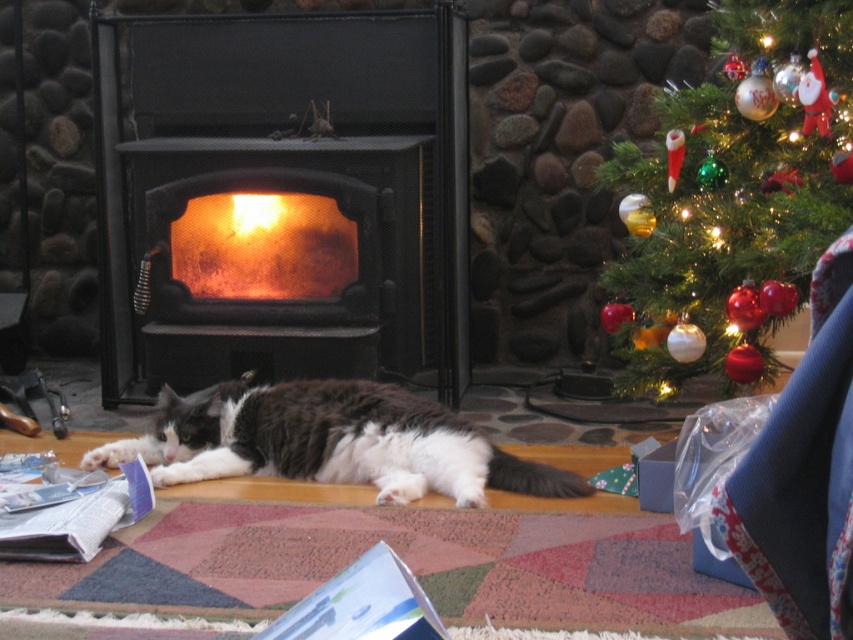
You are standing at the entrance of the room and want to move towards the fireplace. There are two points marked in the scene, point (x=624, y=276) and point (x=328, y=432). Which point should you step on first to reach the fireplace?

You should step on point (x=624, y=276) first because it is in front of point (x=328, y=432), meaning it is closer to your starting position at the entrance.

You are standing in the room and want to take a photo of both the fluffy white and gray cat at center and the orange glassy fire at center. Which object should you position to the left side of your camera frame to include both in the shot?

Since the fluffy white and gray cat at center is to the right of the orange glassy fire at center, you should position the orange glassy fire at center on the left side of your camera frame to include both in the shot.

You are a guest at a Christmas party and want to admire the shiny glass ornaments at upper right without disturbing the fluffy white and gray cat at center. How should you position yourself relative to the cat?

The shiny glass ornaments at upper right are above the fluffy white and gray cat at center, so you can stand behind the cat to view the ornaments without disturbing it.